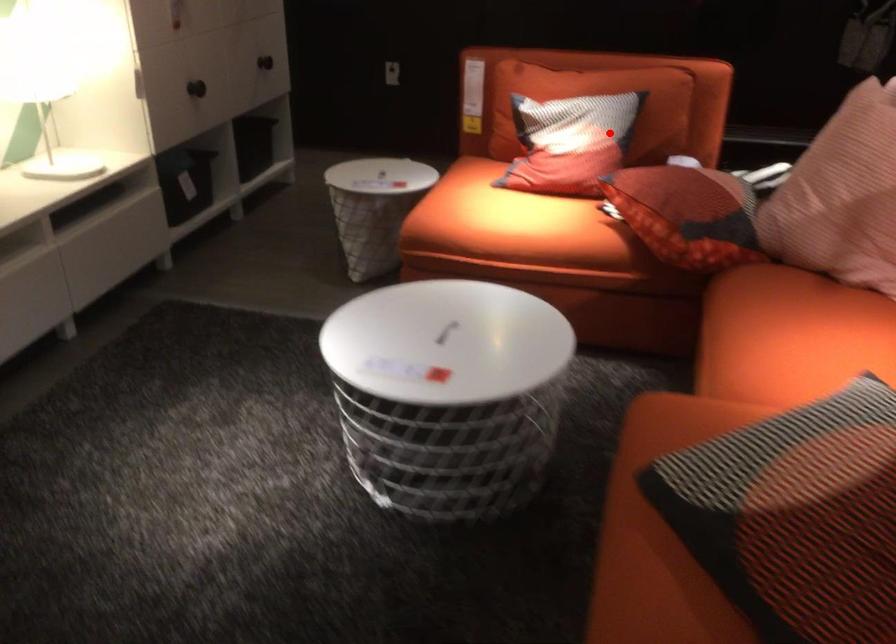
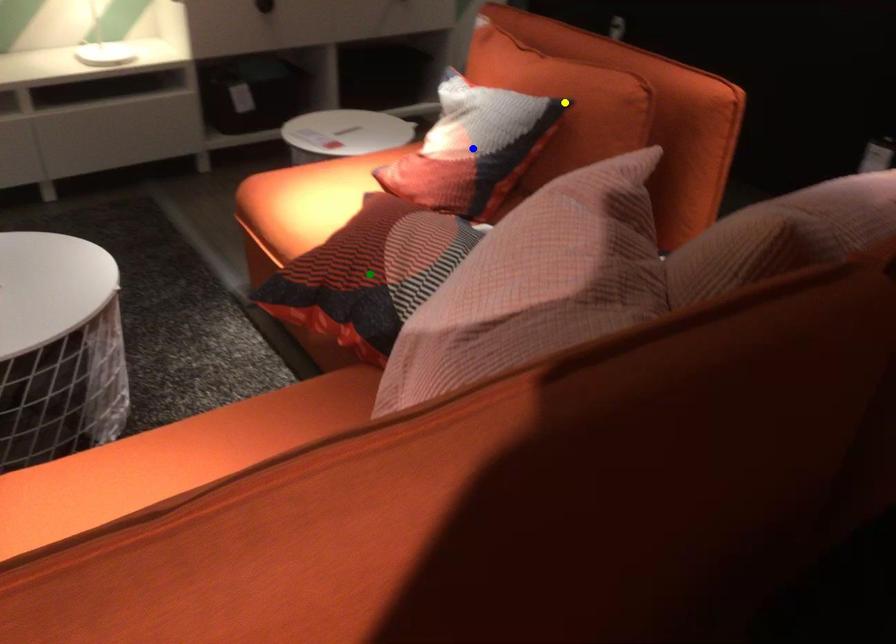
Question: I am providing you with two images of the same scene from different viewpoints. A red point is marked on the first image. You are given multiple points on the second image. Which point in image 2 is actually the same real-world point as the red point in image 1?

Choices:
 (A) yellow point
 (B) green point
 (C) blue point

Answer: (C)